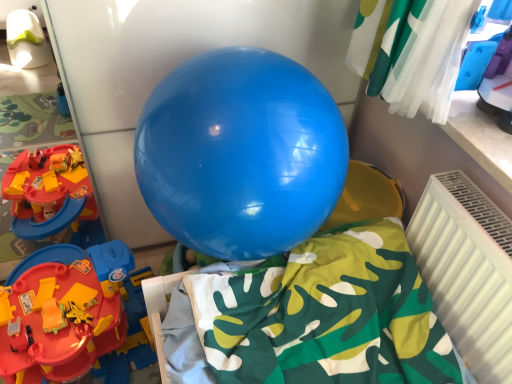
The image size is (512, 384). What do you see at coordinates (241, 153) in the screenshot?
I see `glossy blue balloon at center` at bounding box center [241, 153].

The width and height of the screenshot is (512, 384). I want to click on glossy blue balloon at center, so click(x=241, y=153).

Is glossy blue balloon at center facing towards white plastic radiator at lower right?

No, glossy blue balloon at center is not aimed at white plastic radiator at lower right.

Is glossy blue balloon at center positioned behind white plastic radiator at lower right?

No, it is not.

Is glossy blue balloon at center next to white plastic radiator at lower right and touching it?

No, glossy blue balloon at center is not next to white plastic radiator at lower right.

You are a GUI agent. You are given a task and a screenshot of the screen. Output one action in this format:
    pyautogui.click(x=<x>, y=<y>)
    Task: Click on the balloon above the white plastic radiator at lower right (from a real-world perspective)
    Image resolution: width=512 pixels, height=384 pixels.
    Given the screenshot: What is the action you would take?
    pyautogui.click(x=241, y=153)

Is rubberized plastic track at left in contact with glossy blue balloon at center?

No, rubberized plastic track at left is not in contact with glossy blue balloon at center.

Is rubberized plastic track at left situated inside glossy blue balloon at center or outside?

rubberized plastic track at left is not inside glossy blue balloon at center, it's outside.

Between rubberized plastic track at left and glossy blue balloon at center, which one has smaller width?

With smaller width is glossy blue balloon at center.

Considering the relative positions of rubberized plastic track at left and white plastic radiator at lower right in the image provided, is rubberized plastic track at left to the left of white plastic radiator at lower right from the viewer's perspective?

Yes.

Which is closer, (x=61, y=328) or (x=450, y=237)?

Point (x=61, y=328).

Do you think rubberized plastic track at left is within white plastic radiator at lower right, or outside of it?

The correct answer is: outside.

From the image's perspective, between rubberized plastic track at left and white plastic radiator at lower right, who is located below?

rubberized plastic track at left.

This screenshot has width=512, height=384. In order to click on balloon above the white plastic radiator at lower right (from the image's perspective) in this screenshot , I will do `click(241, 153)`.

Choose the correct answer: Is white plastic radiator at lower right inside glossy blue balloon at center or outside it?

white plastic radiator at lower right cannot be found inside glossy blue balloon at center.

Which object is closer to the camera, white plastic radiator at lower right or glossy blue balloon at center?

glossy blue balloon at center.

Considering the positions of objects white plastic radiator at lower right and glossy blue balloon at center in the image provided, who is more to the left, white plastic radiator at lower right or glossy blue balloon at center?

glossy blue balloon at center is more to the left.

Which of these two, glossy blue balloon at center or rubberized plastic track at left, stands taller?

Standing taller between the two is glossy blue balloon at center.

Is glossy blue balloon at center positioned in front of rubberized plastic track at left?

That is True.

From the image's perspective, is glossy blue balloon at center above or below rubberized plastic track at left?

Based on their image positions, glossy blue balloon at center is located above rubberized plastic track at left.

From a real-world perspective, is white plastic radiator at lower right below rubberized plastic track at left?

No, from a real-world perspective, white plastic radiator at lower right is not beneath rubberized plastic track at left.

In the scene shown: Is white plastic radiator at lower right facing towards rubberized plastic track at left?

Yes, white plastic radiator at lower right is facing rubberized plastic track at left.

From the image's perspective, is white plastic radiator at lower right on rubberized plastic track at left?

Yes.

The image size is (512, 384). In the image, there is a glossy blue balloon at center. What are the coordinates of `radiator below it (from a real-world perspective)` in the screenshot? It's located at (467, 270).

This screenshot has height=384, width=512. What are the coordinates of `balloon that is in front of the rubberized plastic track at left` in the screenshot? It's located at (241, 153).

When comparing their distances from glossy blue balloon at center, does rubberized plastic track at left or white plastic radiator at lower right seem closer?

white plastic radiator at lower right lies closer to glossy blue balloon at center than the other object.

Which object lies nearer to the anchor point glossy blue balloon at center, white plastic radiator at lower right or rubberized plastic track at left?

white plastic radiator at lower right.

Looking at the image, which one is located closer to white plastic radiator at lower right, rubberized plastic track at left or glossy blue balloon at center?

The object closer to white plastic radiator at lower right is glossy blue balloon at center.

Looking at the image, which one is located further to white plastic radiator at lower right, glossy blue balloon at center or rubberized plastic track at left?

rubberized plastic track at left lies further to white plastic radiator at lower right than the other object.

From the image, which object appears to be nearer to rubberized plastic track at left, glossy blue balloon at center or white plastic radiator at lower right?

glossy blue balloon at center.

From the image, which object appears to be nearer to rubberized plastic track at left, white plastic radiator at lower right or glossy blue balloon at center?

Among the two, glossy blue balloon at center is located nearer to rubberized plastic track at left.

Where is `balloon situated between rubberized plastic track at left and white plastic radiator at lower right from left to right`? balloon situated between rubberized plastic track at left and white plastic radiator at lower right from left to right is located at coordinates (241, 153).